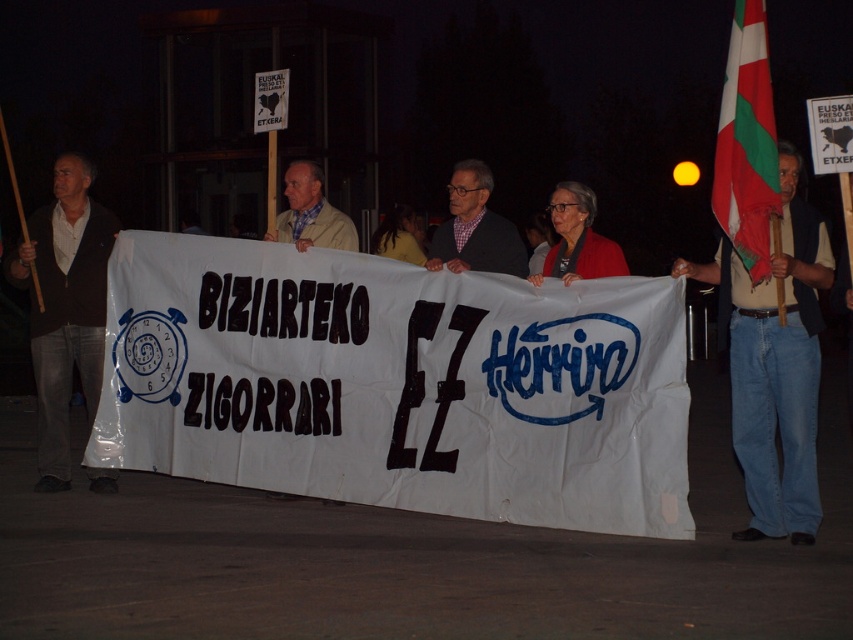
Looking at this image, who is shorter, dark brown leather jacket at left or checkered fabric shirt at center?

checkered fabric shirt at center is shorter.

Describe the element at coordinates (65, 307) in the screenshot. I see `dark brown leather jacket at left` at that location.

This screenshot has width=853, height=640. Find the location of `dark brown leather jacket at left`. dark brown leather jacket at left is located at coordinates (65, 307).

Does green-white striped flag at right have a lesser width compared to light beige jacket at center?

Indeed, green-white striped flag at right has a lesser width compared to light beige jacket at center.

From the picture: Which of these two, green-white striped flag at right or light beige jacket at center, stands shorter?

light beige jacket at center is shorter.

At what (x,y) coordinates should I click in order to perform the action: click on green-white striped flag at right. Please return your answer as a coordinate pair (x, y). Image resolution: width=853 pixels, height=640 pixels. Looking at the image, I should click on (747, 144).

Is denim jeans at center shorter than green-white striped flag at right?

Incorrect, denim jeans at center's height does not fall short of green-white striped flag at right's.

Is denim jeans at center below green-white striped flag at right?

Yes, denim jeans at center is below green-white striped flag at right.

Is point (770, 490) more distant than point (733, 36)?

Yes, point (770, 490) is farther from viewer.

Identify the location of denim jeans at center. The width and height of the screenshot is (853, 640). (775, 364).